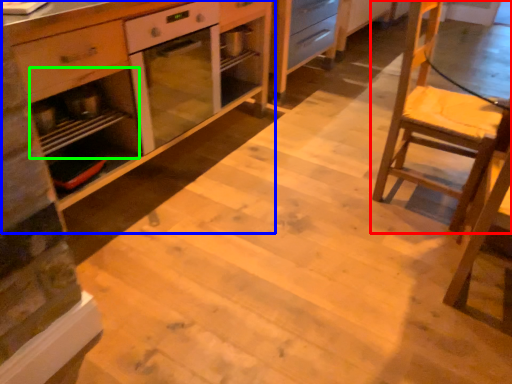
Question: Based on their relative distances, which object is farther from chair (highlighted by a red box)? Choose from cabinetry (highlighted by a blue box) and shelf (highlighted by a green box).

Choices:
 (A) cabinetry
 (B) shelf

Answer: (B)